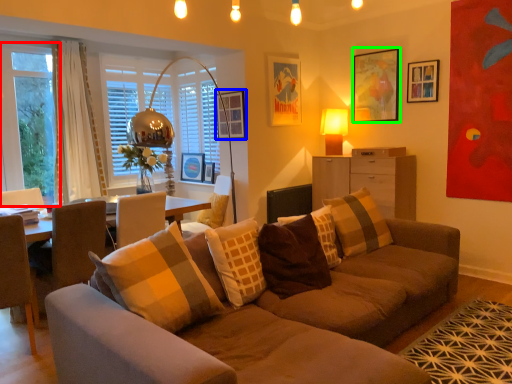
Question: Which object is the closest to the window screen (highlighted by a red box)? Choose among these: picture frame (highlighted by a blue box) or picture frame (highlighted by a green box).

Choices:
 (A) picture frame
 (B) picture frame

Answer: (A)